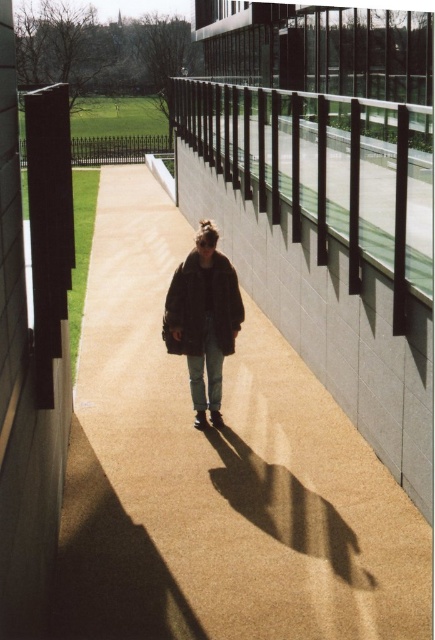
Can you confirm if brown textured pavement at center is smaller than dark brown leather jacket at center?

Incorrect, brown textured pavement at center is not smaller in size than dark brown leather jacket at center.

Based on the photo, which is more to the right, brown textured pavement at center or dark brown leather jacket at center?

dark brown leather jacket at center

Who is more forward, (144, 282) or (207, 292)?

Point (207, 292) is in front.

Where is `brown textured pavement at center`? brown textured pavement at center is located at coordinates (217, 474).